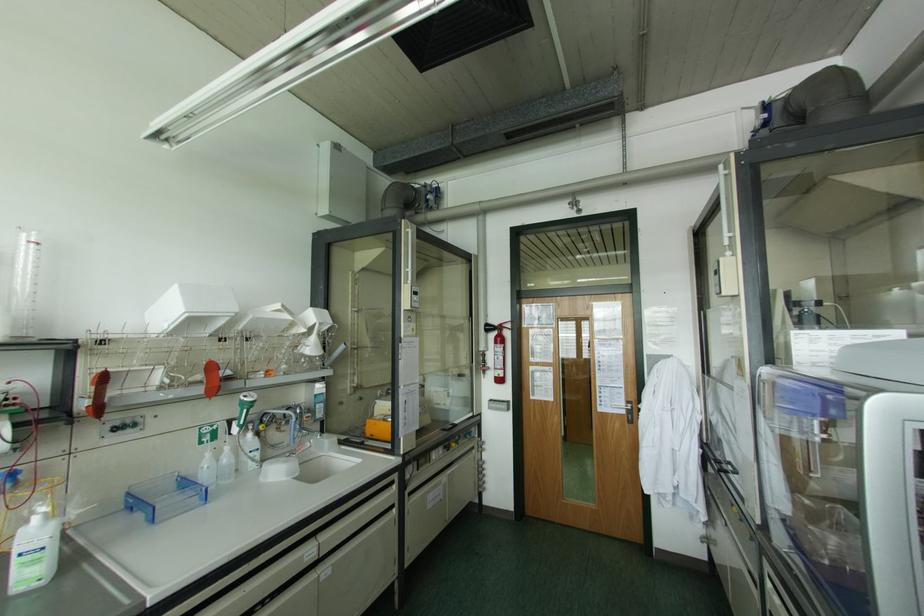
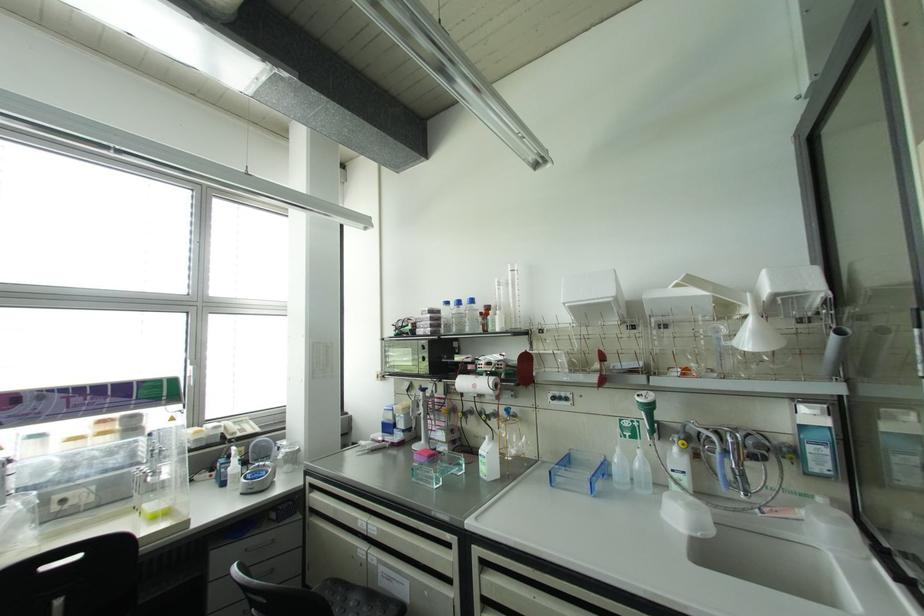
Where in the second image is the point corresponding to [295,411] from the first image?

(723, 440)